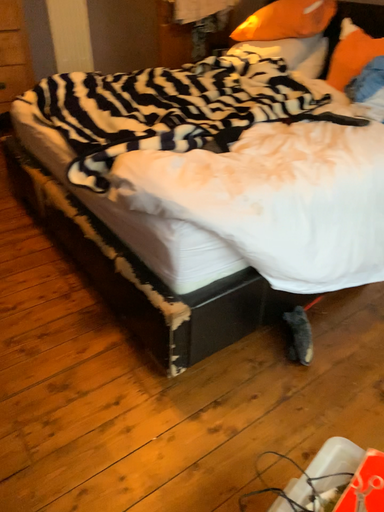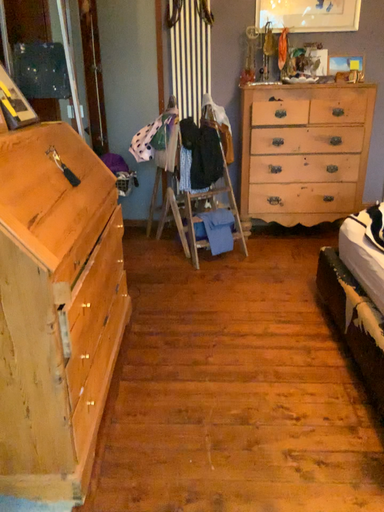
Question: How did the camera likely rotate when shooting the video?

Choices:
 (A) rotated right
 (B) rotated left

Answer: (B)